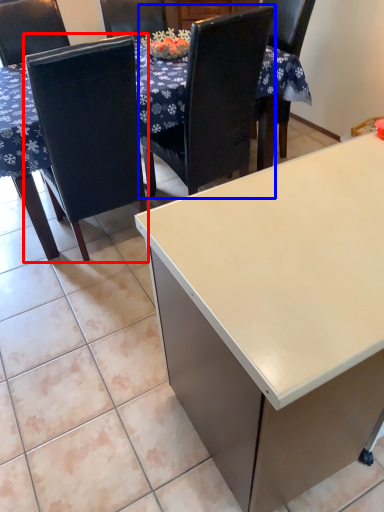
Question: Which object appears closest to the camera in this image, chair (highlighted by a red box) or chair (highlighted by a blue box)?

Choices:
 (A) chair
 (B) chair

Answer: (A)